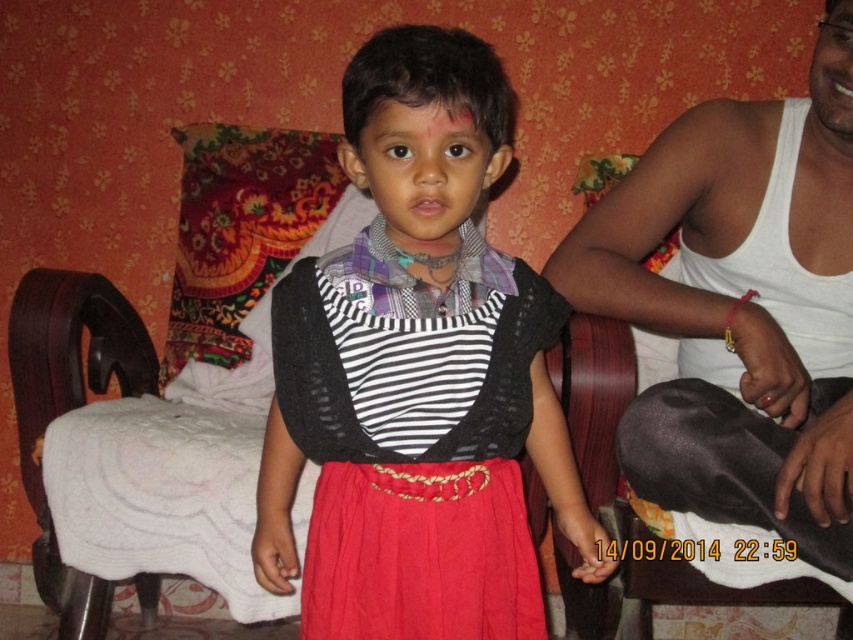
Between matte black sweater at center and white tank top at right, which one is positioned lower?

matte black sweater at center is below.

Between point (416, 556) and point (618, 428), which one is positioned behind?

The point (618, 428) is more distant.

Find the location of a particular element. Image resolution: width=853 pixels, height=640 pixels. matte black sweater at center is located at coordinates (x=418, y=374).

This screenshot has height=640, width=853. In order to click on matte black sweater at center in this screenshot , I will do `click(418, 374)`.

Between point (543, 419) and point (178, 204), which one is positioned behind?

Point (178, 204)

Locate an element on the screen. matte black sweater at center is located at coordinates (418, 374).

Between white tank top at right and white fabric armchair at left, which one is positioned higher?

white fabric armchair at left is higher up.

Who is more forward, (x=677, y=122) or (x=57, y=280)?

Point (x=677, y=122)

You are a GUI agent. You are given a task and a screenshot of the screen. Output one action in this format:
    pyautogui.click(x=<x>, y=<y>)
    Task: Click on the white tank top at right
    This screenshot has height=640, width=853.
    Given the screenshot: What is the action you would take?
    pyautogui.click(x=741, y=321)